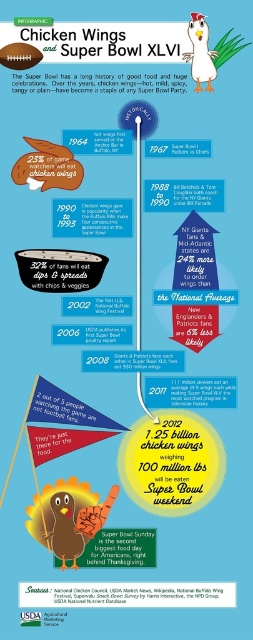
Question: Which of the following is the closest to the observer?

Choices:
 (A) matte brown chicken wings at upper left
 (B) brown matte turkey at center

Answer: (B)

Question: Is brown matte turkey at center above matte brown chicken wings at upper left?

Choices:
 (A) yes
 (B) no

Answer: (B)

Question: Can you confirm if brown matte turkey at center is positioned above matte brown chicken wings at upper left?

Choices:
 (A) no
 (B) yes

Answer: (A)

Question: Is brown matte turkey at center to the left of matte brown chicken wings at upper left from the viewer's perspective?

Choices:
 (A) no
 (B) yes

Answer: (A)

Question: Which object is closer to the camera taking this photo?

Choices:
 (A) brown matte turkey at center
 (B) matte brown chicken wings at upper left

Answer: (A)

Question: Which of the following is the closest to the observer?

Choices:
 (A) brown matte turkey at center
 (B) matte brown chicken wings at upper left

Answer: (A)